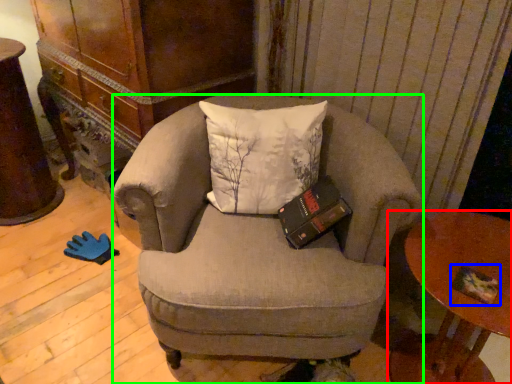
Question: Which object is positioned farthest from table (highlighted by a red box)? Select from paperback book (highlighted by a blue box) and chair (highlighted by a green box).

Choices:
 (A) paperback book
 (B) chair

Answer: (B)